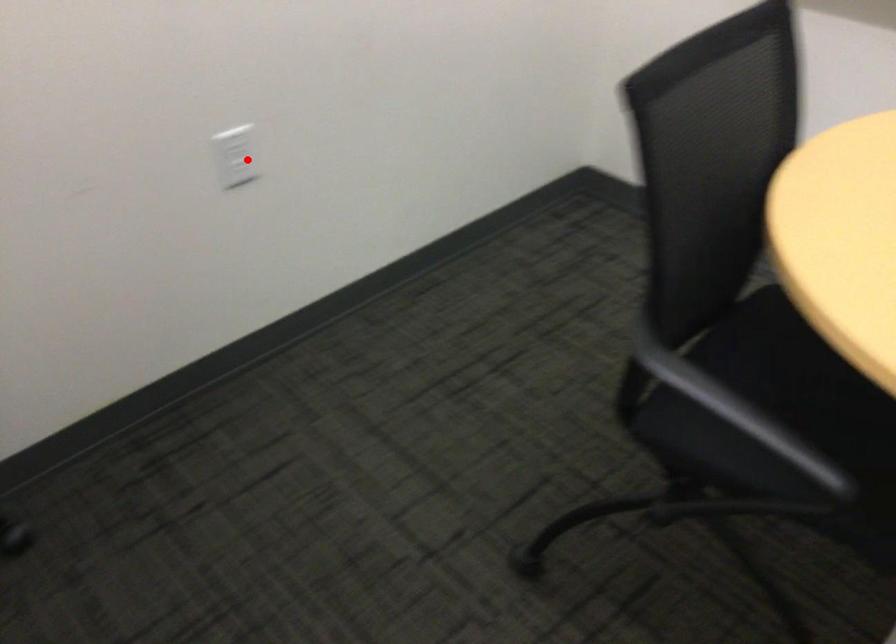
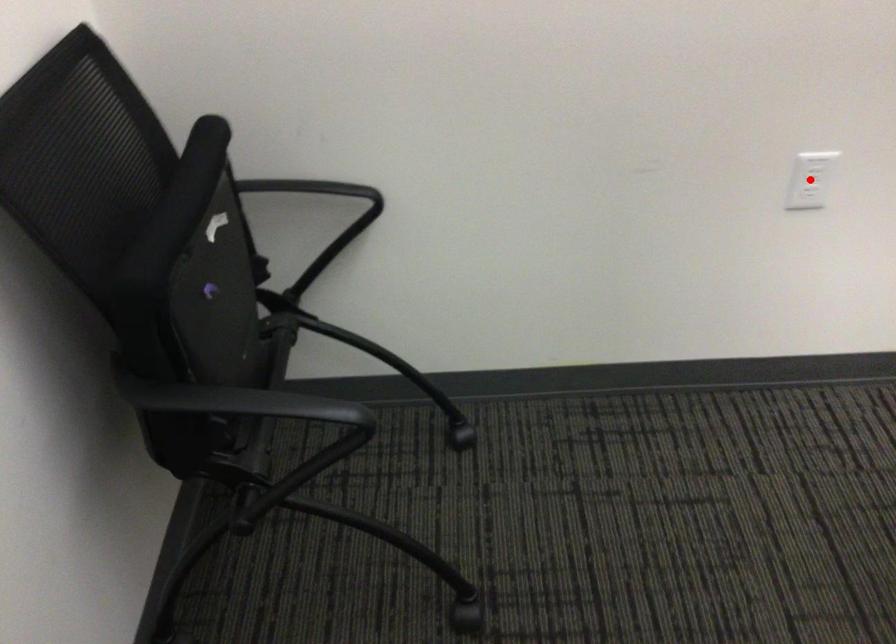
I am providing you with two images of the same scene from different viewpoints. A red point is marked on the first image and another point is marked on the second image. Is the marked point in image1 the same physical position as the marked point in image2?

Yes